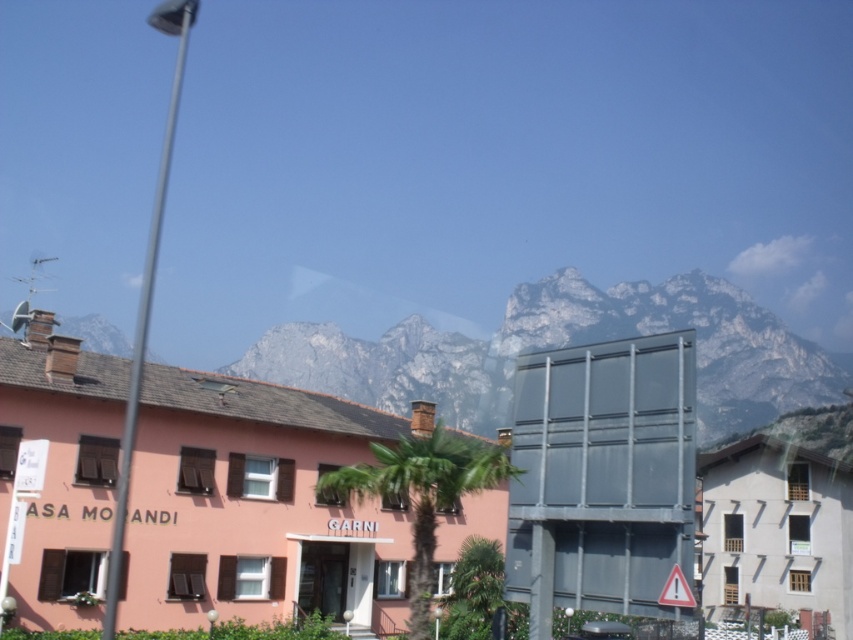
You are standing at the point marked by the coordinates point [776,531] in the image. What is the closest object to you in the scene?

The point [776,531] indicates the white wooden building at lower right, so the closest object to you is the white wooden building at lower right.

You are standing in the urban scene looking at the pink building with the palm tree in front of it. There are two points marked in the image. The first point is at coordinates point [457,410] and the second is at point [688,605]. Which point is closer to you?

Point [457,410] is further to the camera than point [688,605], so the second point is closer to you.